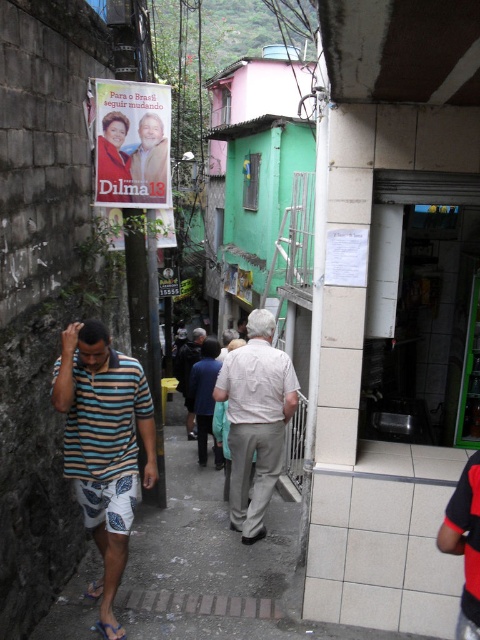
Question: Estimate the real-world distances between objects in this image. Which object is farther from the matte paper poster at upper left?

Choices:
 (A) white plastic sandal at lower left
 (B) light beige cotton shirt at center

Answer: (A)

Question: Which point is farther to the camera?

Choices:
 (A) white plastic sandal at lower left
 (B) blue fabric sandal at lower left
 (C) light beige cotton shirt at center

Answer: (C)

Question: Is white plastic sandal at lower left smaller than blue fabric sandal at lower left?

Choices:
 (A) yes
 (B) no

Answer: (B)

Question: Estimate the real-world distances between objects in this image. Which object is farther from the striped cotton shirt at left?

Choices:
 (A) matte paper poster at upper left
 (B) brick pavement at center

Answer: (A)

Question: Is light beige cotton shirt at center positioned in front of blue fabric sandal at lower left?

Choices:
 (A) no
 (B) yes

Answer: (A)

Question: Where is white plastic sandal at lower left located in relation to blue fabric sandal at lower left in the image?

Choices:
 (A) below
 (B) above

Answer: (A)